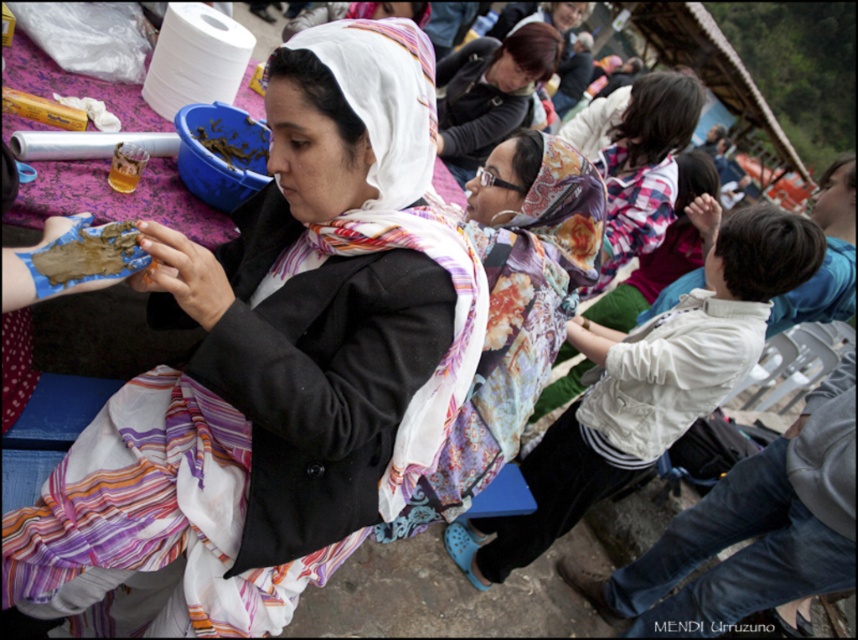
You are an observer at the event and notice two items at the center of the scene. Which one is taller between the striped silk scarf at center and the white fabric headscarf at center?

The striped silk scarf at center is taller than the white fabric headscarf at center according to the description.

You are at a community event and want to find the striped silk scarf at center. According to the coordinates provided, where should you look?

The striped silk scarf at center is located at coordinates point (154, 518).